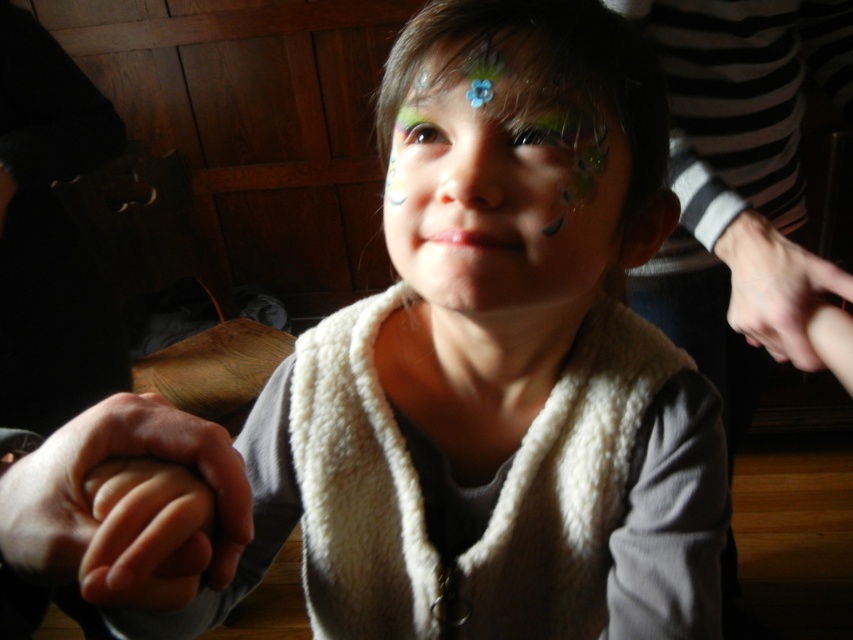
You are a photographer setting up for a family photo. You need to position a small blue flower at the center so it can be seen clearly between the child and the hand holding theirs. Considering the sizes of the smooth skin hand at lower left and the shiny blue flower at center, which object is smaller in width?

The smooth skin hand at lower left has a lesser width compared to the shiny blue flower at center, so the smooth skin hand at lower left is smaller in width.

You are designing a costume for a play and need to ensure that the white fluffy vest at center can be worn over the smooth skin hand at lower left. Based on the image, will the vest be large enough to accommodate the hand?

The white fluffy vest at center is larger in size than the smooth skin hand at lower left, so the vest should be large enough to accommodate the hand comfortably.